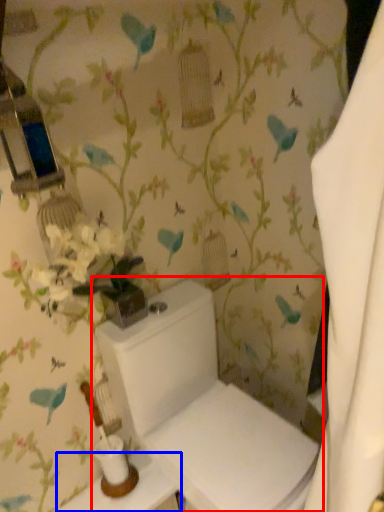
Question: Which object appears closest to the camera in this image, toilet (highlighted by a red box) or table (highlighted by a blue box)?

Choices:
 (A) toilet
 (B) table

Answer: (A)